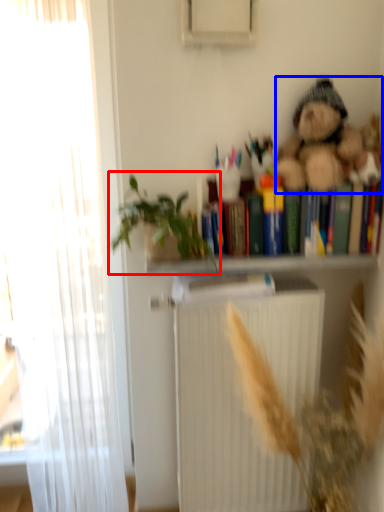
Question: Which object appears closest to the camera in this image, houseplant (highlighted by a red box) or teddy bear (highlighted by a blue box)?

Choices:
 (A) houseplant
 (B) teddy bear

Answer: (A)